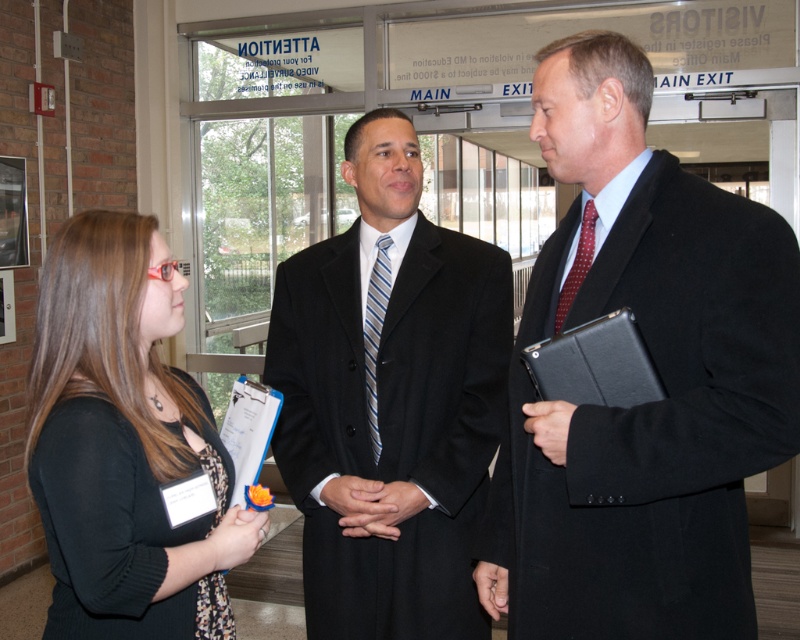
You are a photographer positioned to the side of the scene. You need to capture a clear photo of both the matte black coat at center and the blue striped tie at center. Which object should you focus on first to ensure both are in frame?

You should focus on the matte black coat at center first since it is larger than the blue striped tie at center, ensuring it fits within the frame before adjusting for the smaller object.

You are standing in the hallway and see two people in the distance. One is wearing a black suit at center and the other has a red dotted tie at center. Which one is on the left side from your perspective?

The black suit at center is on the left side from your perspective because it is positioned to the left of the red dotted tie at center.